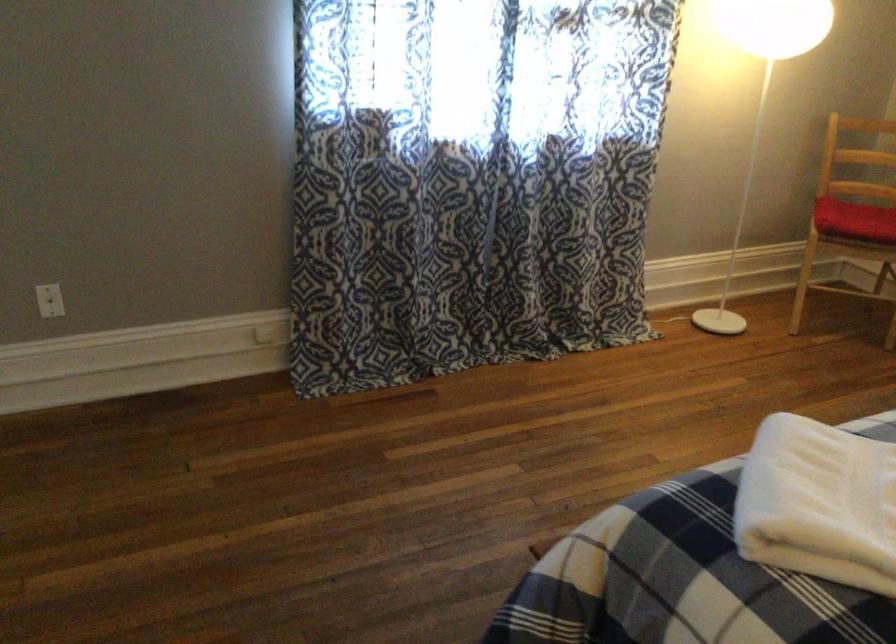
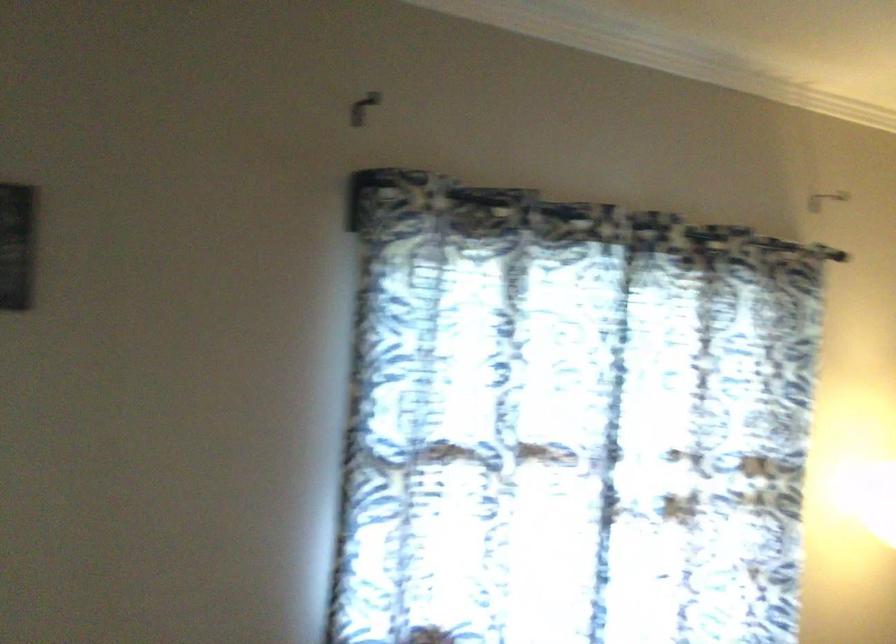
Question: Based on the continuous images, in which direction is the camera rotating? Reply with the corresponding letter.

Choices:
 (A) Left
 (B) Right
 (C) Up
 (D) Down

Answer: (C)